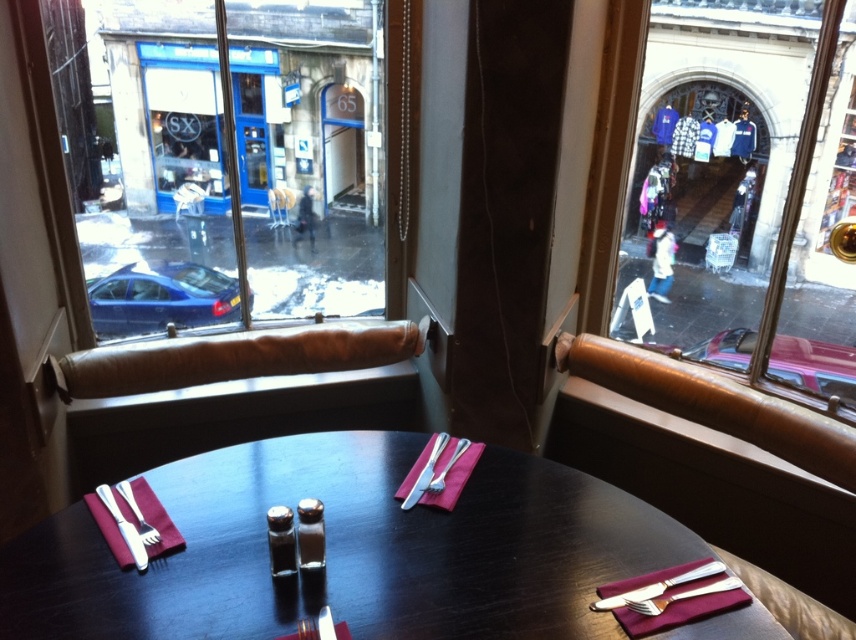
At what (x,y) coordinates should I click in order to perform the action: click on glass window at upper right. Please return your answer as a coordinate pair (x, y). Looking at the image, I should click on (747, 195).

I want to click on glass window at upper right, so click(x=747, y=195).

Does point (15, 582) lie behind point (158, 552)?

No, it is in front of (158, 552).

The width and height of the screenshot is (856, 640). What do you see at coordinates (348, 550) in the screenshot?
I see `shiny dark wood table at center` at bounding box center [348, 550].

Who is more distant from viewer, (373, 484) or (141, 477)?

The point (373, 484) is more distant.

Identify the location of shiny dark wood table at center. (348, 550).

Does glass window at upper right appear over silver/golden metal fork at lower right?

Yes, glass window at upper right is above silver/golden metal fork at lower right.

Is glass window at upper right to the left of silver/golden metal fork at lower right from the viewer's perspective?

No, glass window at upper right is not to the left of silver/golden metal fork at lower right.

Which is in front, point (722, 17) or point (655, 602)?

Point (655, 602)

Identify the location of glass window at upper right. (747, 195).